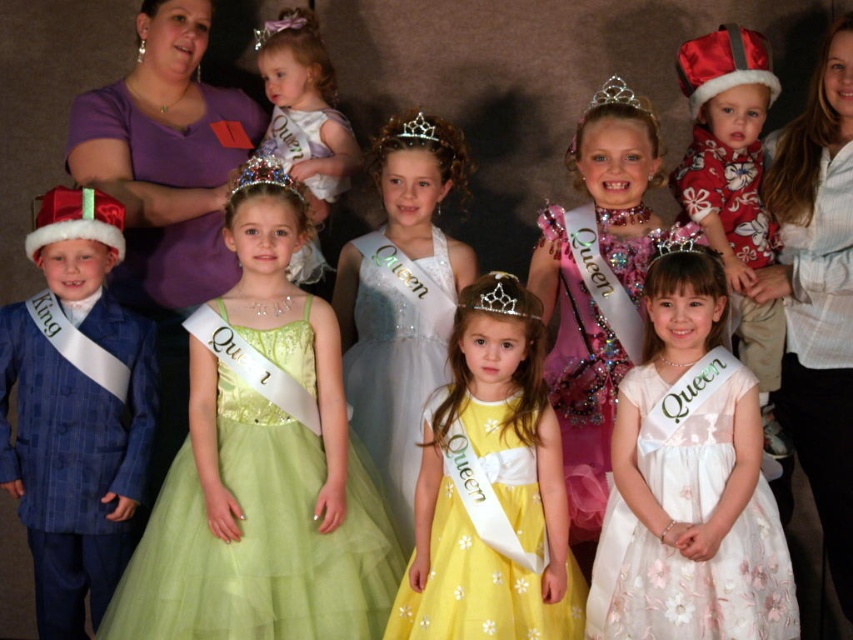
Question: Does blue plaid suit at left appear over gold metallic crown at center?

Choices:
 (A) yes
 (B) no

Answer: (B)

Question: Which object is the farthest from the matte white dress at center?

Choices:
 (A) white satin dress at center
 (B) matte red dress at center
 (C) yellow satin dress at center

Answer: (B)

Question: Estimate the real-world distances between objects in this image. Which object is farther from the purple fabric at upper left?

Choices:
 (A) yellow satin dress at center
 (B) white satin dress at center

Answer: (A)

Question: Is matte red santa hat at left thinner than sparkly silver tiara at center?

Choices:
 (A) yes
 (B) no

Answer: (B)

Question: Does matte red santa hat at left have a smaller size compared to silver metallic tiara at upper center?

Choices:
 (A) no
 (B) yes

Answer: (B)

Question: Which is farther from the yellow satin dress at center?

Choices:
 (A) matte red santa hat at left
 (B) white striped shirt at upper right

Answer: (A)